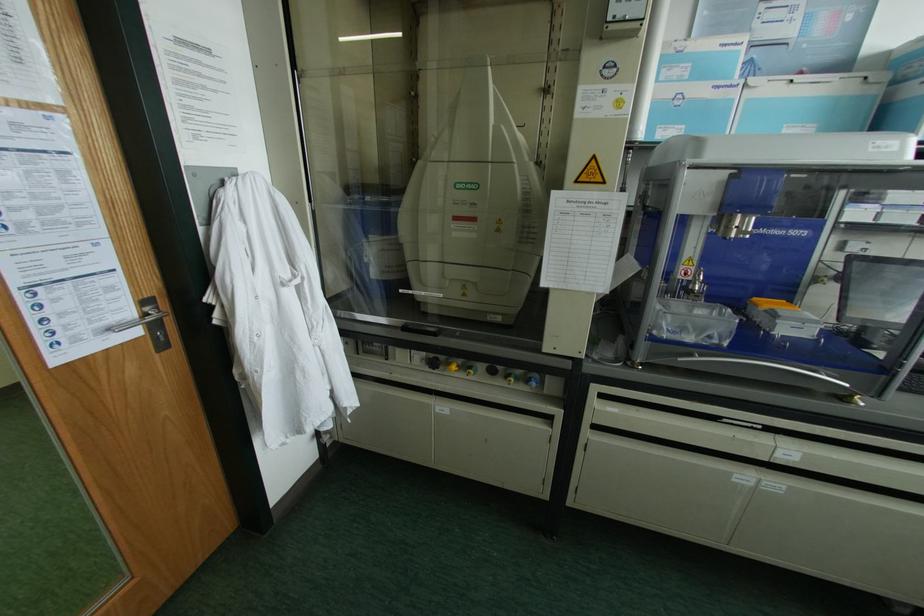
Where is `red power switch`? The image size is (924, 616). red power switch is located at coordinates (465, 216).